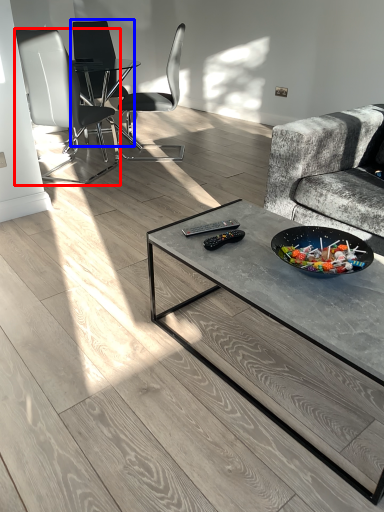
Question: Which of the following is the farthest to the observer, chair (highlighted by a red box) or chair (highlighted by a blue box)?

Choices:
 (A) chair
 (B) chair

Answer: (B)